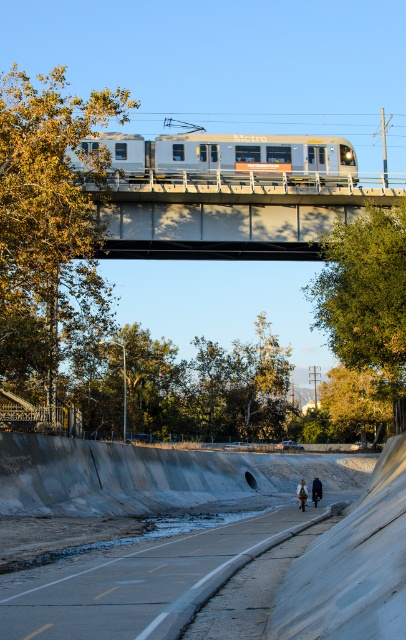
Question: Is metal/textured bridge at upper center smaller than gray concrete sidewalk at lower center?

Choices:
 (A) yes
 (B) no

Answer: (A)

Question: Can you confirm if gray concrete sidewalk at lower center is thinner than silver metallic train at upper center?

Choices:
 (A) yes
 (B) no

Answer: (A)

Question: Is metal/textured bridge at upper center wider than silver metallic train at upper center?

Choices:
 (A) yes
 (B) no

Answer: (B)

Question: Which point is farther to the camera?

Choices:
 (A) gray concrete sidewalk at lower center
 (B) metal/textured bridge at upper center
 (C) silver metallic train at upper center

Answer: (B)

Question: Which point is closer to the camera taking this photo?

Choices:
 (A) (338, 212)
 (B) (84, 612)
 (C) (196, 164)

Answer: (B)

Question: Which is nearer to the silver metallic train at upper center?

Choices:
 (A) metal/textured bridge at upper center
 (B) gray concrete sidewalk at lower center

Answer: (A)